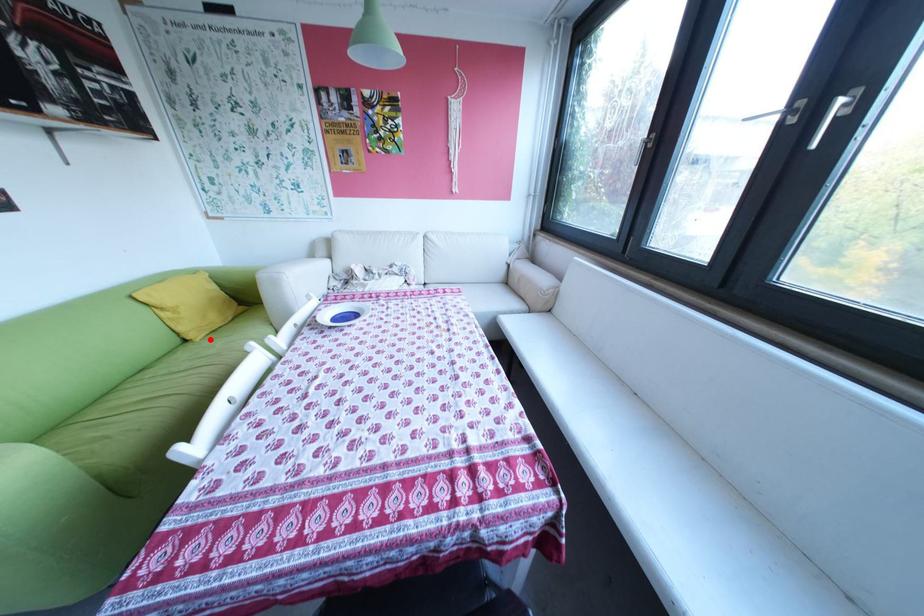
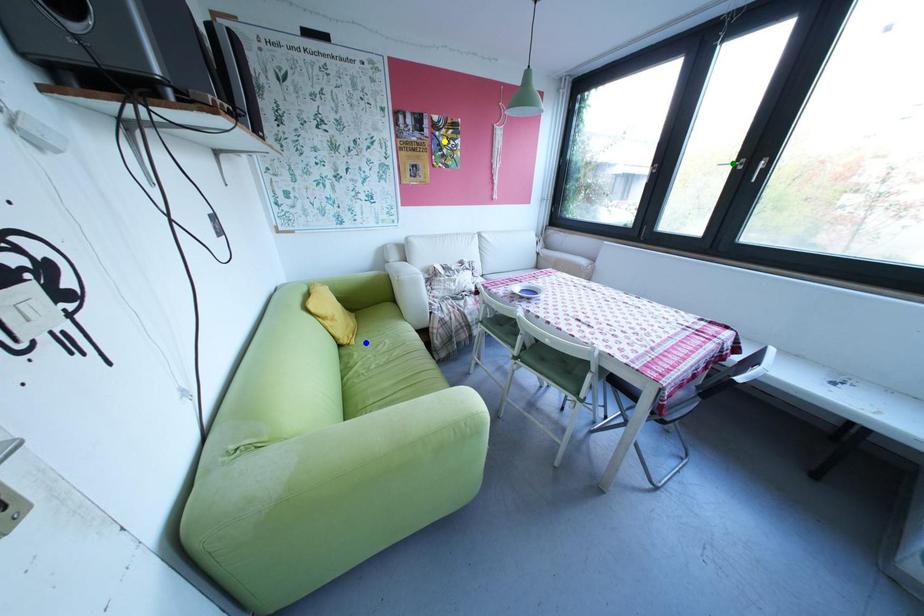
Question: I am providing you with two images of the same scene from different viewpoints. A red point is marked on the first image. You are given multiple points on the second image. Can you choose the point in image 2 that corresponds to the point in image 1?

Choices:
 (A) yellow point
 (B) blue point
 (C) green point

Answer: (B)